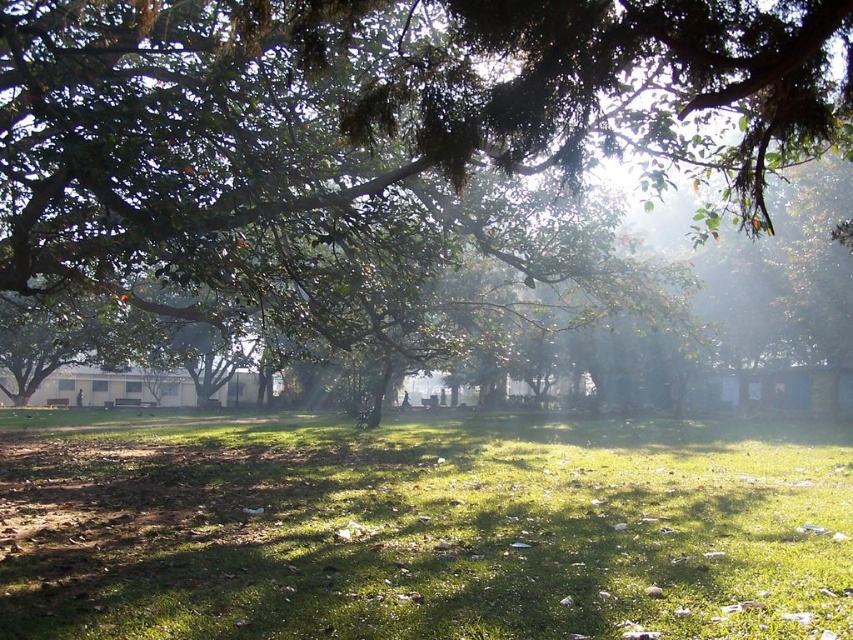
You are standing at the point marked as point (424, 531) in the image. Looking around, you see green grass at center. What is under your feet?

The point (424, 531) is on green grass at center, so the ground under your feet is green grass at center.

You are a gardener who wants to plant a new flower bed in the green grass at center. Considering the green leafy tree at center, will the tree overshadow the flower bed?

The green leafy tree at center is taller than the green grass at center, so yes, the tree will overshadow the flower bed planted in the green grass at center.